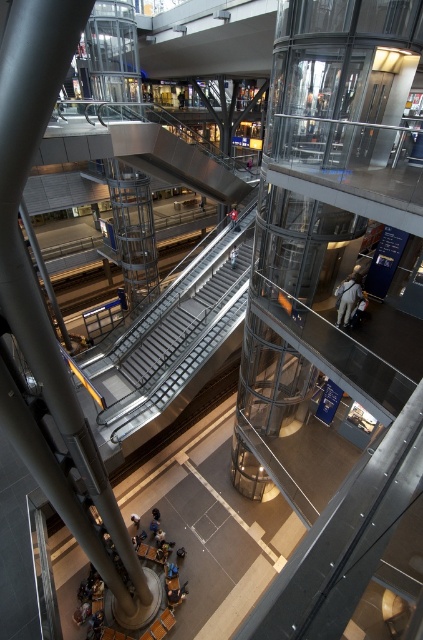
Does metallic silver escalator at center have a larger size compared to white fabric person at center?

Correct, metallic silver escalator at center is larger in size than white fabric person at center.

Between point (109, 372) and point (231, 253), which one is positioned behind?

Point (231, 253)

Where is `metallic silver escalator at center`? metallic silver escalator at center is located at coordinates (172, 337).

The width and height of the screenshot is (423, 640). Describe the element at coordinates (348, 298) in the screenshot. I see `light brown leather jacket at center` at that location.

Is point (351, 292) closer to camera compared to point (230, 218)?

Yes, it is in front of point (230, 218).

Does point (348, 282) come behind point (235, 220)?

No, (348, 282) is in front of (235, 220).

You are a GUI agent. You are given a task and a screenshot of the screen. Output one action in this format:
    pyautogui.click(x=<x>, y=<y>)
    Task: Click on the light brown leather jacket at center
    The image size is (423, 640).
    Given the screenshot: What is the action you would take?
    pyautogui.click(x=348, y=298)

Does light brown leather jacket at center have a larger size compared to white fabric person at center?

Yes, light brown leather jacket at center is bigger than white fabric person at center.

Does light brown leather jacket at center have a lesser width compared to white fabric person at center?

No.

Which is in front, point (346, 280) or point (230, 257)?

Point (346, 280) is more forward.

Locate an element on the screen. This screenshot has height=640, width=423. light brown leather jacket at center is located at coordinates (348, 298).